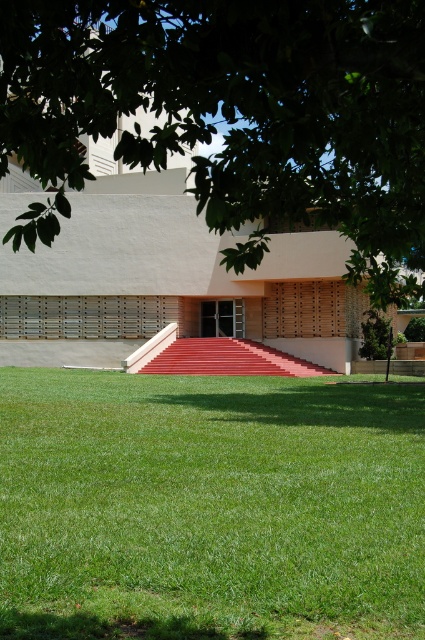
Question: Is green leafy tree at upper center to the left of red carpeted stairs at center from the viewer's perspective?

Choices:
 (A) no
 (B) yes

Answer: (B)

Question: Does green grass at lower center appear under green leafy tree at upper center?

Choices:
 (A) yes
 (B) no

Answer: (A)

Question: Which object is positioned farthest from the green leafy tree at upper center?

Choices:
 (A) green grass at lower center
 (B) red carpeted stairs at center

Answer: (B)

Question: Among these objects, which one is nearest to the camera?

Choices:
 (A) green leafy tree at upper center
 (B) green grass at lower center
 (C) red carpeted stairs at center

Answer: (A)

Question: Which is nearer to the green grass at lower center?

Choices:
 (A) green leafy tree at upper center
 (B) red carpeted stairs at center

Answer: (A)

Question: Can you confirm if green leafy tree at upper center is positioned below red carpeted stairs at center?

Choices:
 (A) no
 (B) yes

Answer: (A)